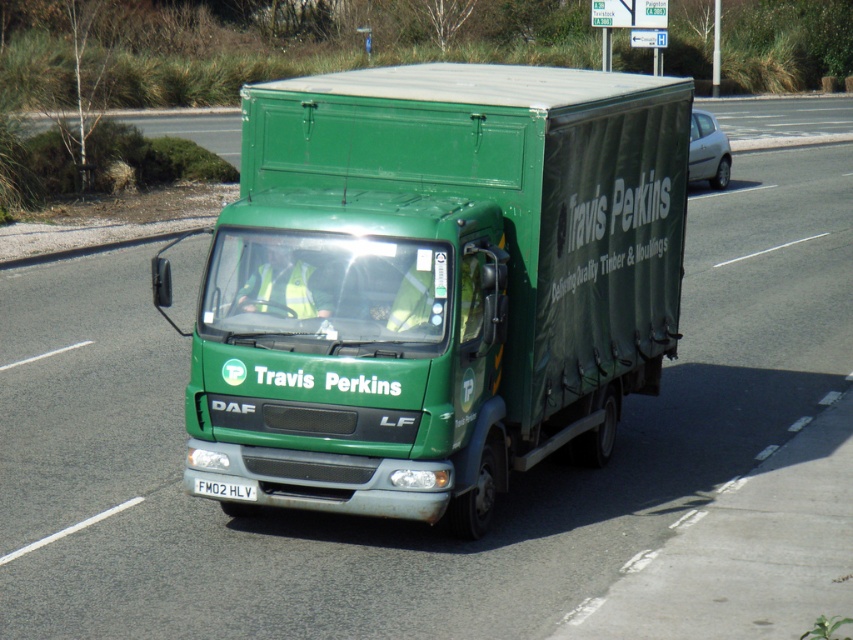
Question: Which of the following is the closest to the observer?

Choices:
 (A) white plastic license plate at center
 (B) green matte truck at center

Answer: (B)

Question: Is green matte truck at center in front of white plastic license plate at center?

Choices:
 (A) no
 (B) yes

Answer: (B)

Question: Which object is farther from the camera taking this photo?

Choices:
 (A) white plastic license plate at center
 (B) green matte truck at center

Answer: (A)

Question: Can you confirm if green matte truck at center is positioned to the right of white plastic license plate at center?

Choices:
 (A) no
 (B) yes

Answer: (B)

Question: Which point is closer to the camera taking this photo?

Choices:
 (A) (241, 243)
 (B) (245, 484)

Answer: (A)

Question: Is green matte truck at center above white plastic license plate at center?

Choices:
 (A) yes
 (B) no

Answer: (A)